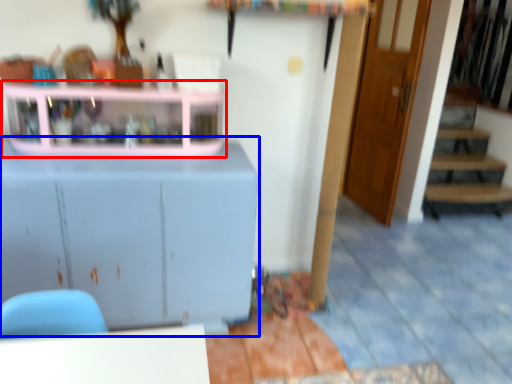
Question: Which object is closer to the camera taking this photo, shelf (highlighted by a red box) or cabinetry (highlighted by a blue box)?

Choices:
 (A) shelf
 (B) cabinetry

Answer: (B)